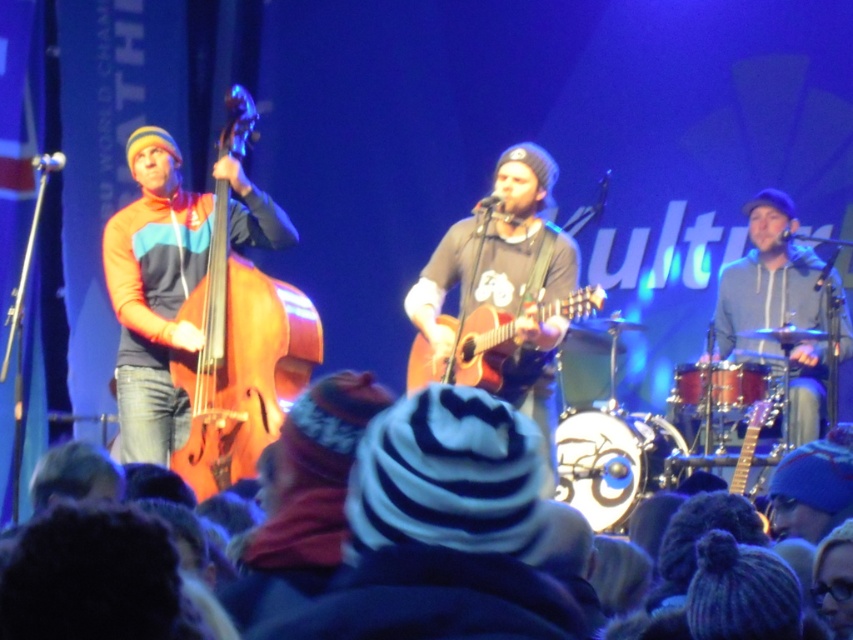
Question: Estimate the real-world distances between objects in this image. Which object is closer to the wooden polished cello at left?

Choices:
 (A) acoustic wood guitar at center
 (B) matte brown acoustic guitar at center

Answer: (A)

Question: Does matte brown acoustic guitar at center appear over acoustic wood guitar at center?

Choices:
 (A) yes
 (B) no

Answer: (A)

Question: Which point is closer to the camera taking this photo?

Choices:
 (A) (546, 390)
 (B) (509, 330)
 (C) (258, 273)

Answer: (B)

Question: Is wooden polished cello at left smaller than acoustic wood guitar at center?

Choices:
 (A) yes
 (B) no

Answer: (B)

Question: Which of the following is the farthest from the observer?

Choices:
 (A) (447, 230)
 (B) (432, 365)
 (C) (196, 305)

Answer: (A)

Question: Can you confirm if matte brown acoustic guitar at center is positioned to the left of acoustic wood guitar at center?

Choices:
 (A) yes
 (B) no

Answer: (A)